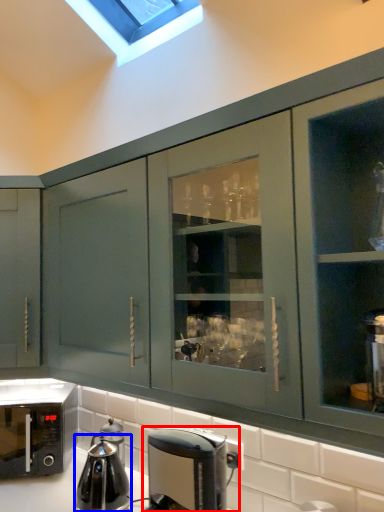
Question: Which object appears farthest to the camera in this image, coffee maker (highlighted by a red box) or kitchen appliance (highlighted by a blue box)?

Choices:
 (A) coffee maker
 (B) kitchen appliance

Answer: (B)